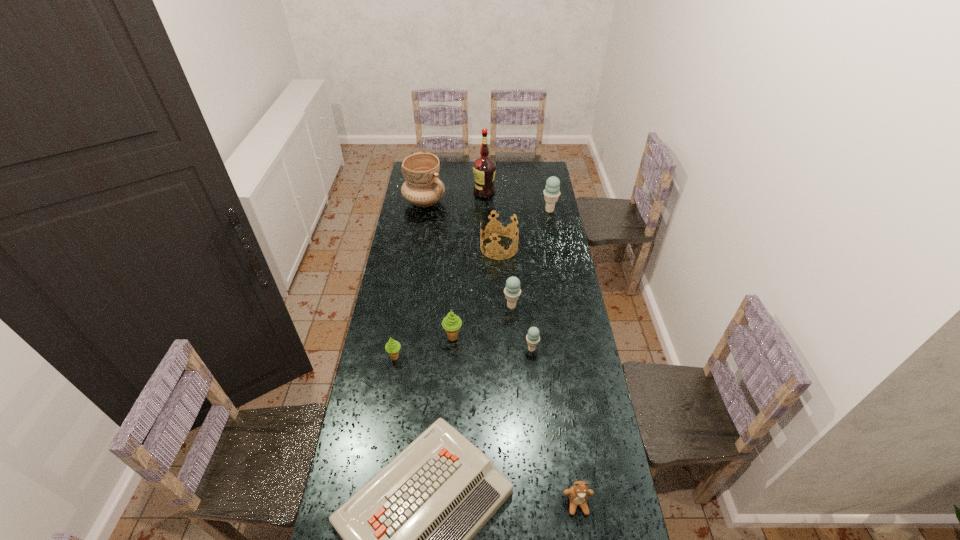
What are the coordinates of `crown` in the screenshot? It's located at (499, 229).

Identify the location of the nearest blue ice cream. click(533, 338).

Locate an element on the screen. The image size is (960, 540). the fourth icecream from left to right is located at coordinates (533, 338).

Locate an element on the screen. the nearer green icecream is located at coordinates (392, 347).

This screenshot has width=960, height=540. I want to click on the leftmost icecream, so click(392, 347).

Locate an element on the screen. The width and height of the screenshot is (960, 540). teddy bear is located at coordinates (578, 493).

Where is `vacant region located 0.110m on the label of the alcohol`? The height and width of the screenshot is (540, 960). vacant region located 0.110m on the label of the alcohol is located at coordinates (454, 192).

This screenshot has height=540, width=960. Identify the location of free space located on the label of the alcohol. (447, 192).

Locate an element on the screen. The height and width of the screenshot is (540, 960). vacant space positioned 0.130m on the label of the alcohol is located at coordinates (451, 192).

Where is `free space located on the front of the ninth shortest object`? free space located on the front of the ninth shortest object is located at coordinates (420, 228).